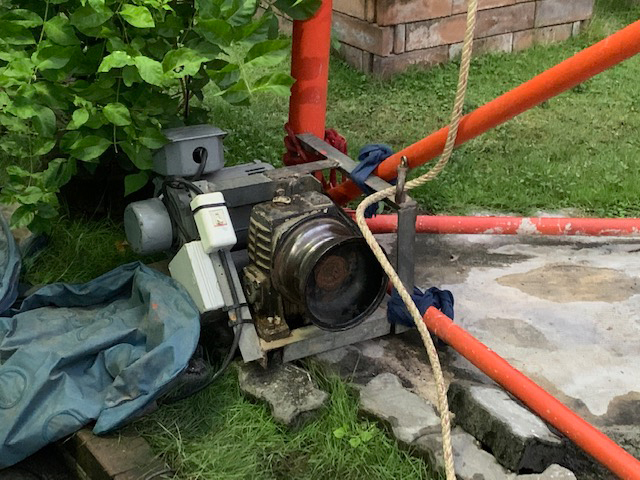
Where is `ledge`? ledge is located at coordinates (100, 443).